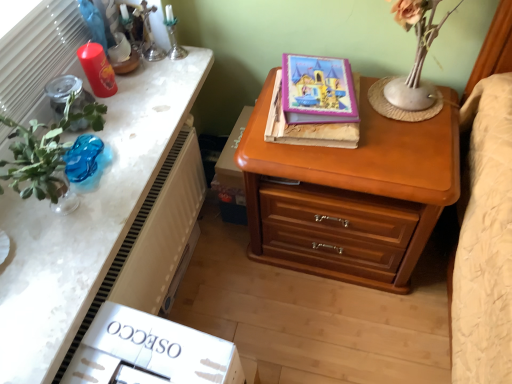
Question: Does purple glossy book at upper center, placed as the first book when sorted from top to bottom, have a lesser height compared to wooden nightstand at upper center?

Choices:
 (A) yes
 (B) no

Answer: (B)

Question: Is wooden nightstand at upper center inside purple glossy book at upper center, which ranks as the second book in bottom-to-top order?

Choices:
 (A) yes
 (B) no

Answer: (B)

Question: Does purple glossy book at upper center, which ranks as the second book in bottom-to-top order, turn towards wooden nightstand at upper center?

Choices:
 (A) yes
 (B) no

Answer: (B)

Question: Is there a large distance between purple glossy book at upper center, which ranks as the second book in bottom-to-top order, and wooden nightstand at upper center?

Choices:
 (A) no
 (B) yes

Answer: (A)

Question: Is purple glossy book at upper center, placed as the first book when sorted from top to bottom, turned away from wooden nightstand at upper center?

Choices:
 (A) yes
 (B) no

Answer: (B)

Question: From the image's perspective, is purple glossy book at upper center, placed as the first book when sorted from top to bottom, located above wooden nightstand at upper center?

Choices:
 (A) no
 (B) yes

Answer: (B)

Question: Is hardcover book at center, which is the 1th book from bottom to top, not near wooden chest of drawers at right?

Choices:
 (A) no
 (B) yes

Answer: (A)

Question: Can you confirm if hardcover book at center, positioned as the 2th book in top-to-bottom order, is thinner than wooden chest of drawers at right?

Choices:
 (A) yes
 (B) no

Answer: (A)

Question: Is hardcover book at center, which is the 1th book from bottom to top, next to wooden chest of drawers at right and touching it?

Choices:
 (A) yes
 (B) no

Answer: (B)

Question: Could you tell me if hardcover book at center, positioned as the 2th book in top-to-bottom order, is facing wooden chest of drawers at right?

Choices:
 (A) yes
 (B) no

Answer: (B)

Question: Can you confirm if hardcover book at center, which is the 1th book from bottom to top, is shorter than wooden chest of drawers at right?

Choices:
 (A) yes
 (B) no

Answer: (A)

Question: From the image's perspective, is hardcover book at center, positioned as the 2th book in top-to-bottom order, on top of wooden chest of drawers at right?

Choices:
 (A) no
 (B) yes

Answer: (B)

Question: Is wooden chest of drawers at right directly adjacent to white textured radiator at left?

Choices:
 (A) yes
 (B) no

Answer: (B)